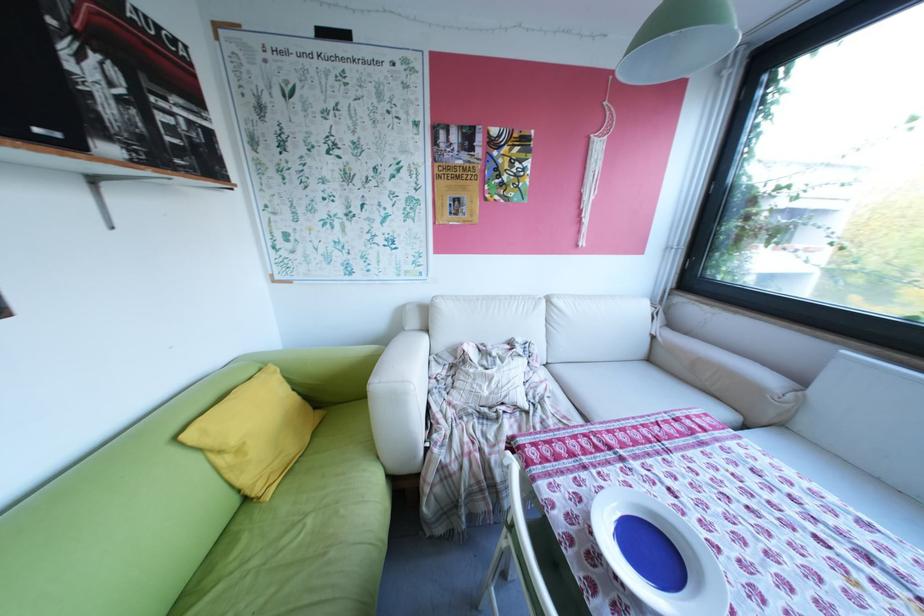
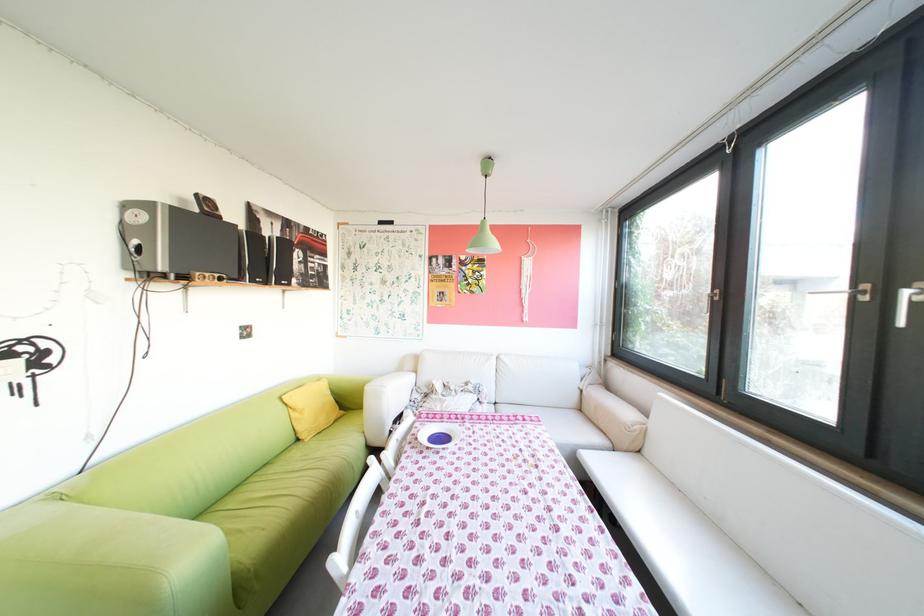
Where in the second image is the point corresponding to (281,496) from the first image?

(321, 440)